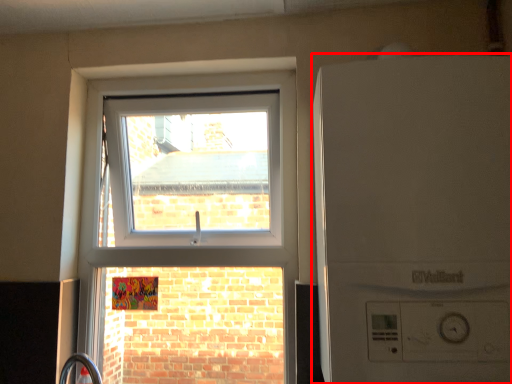
Question: From the image, what is the correct spatial relationship of washing machine (annotated by the red box) in relation to window?

Choices:
 (A) right
 (B) left

Answer: (A)